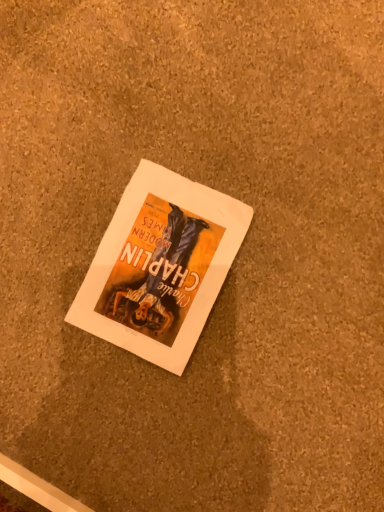
Find the location of `vacant area that is in front of matte paper book at center`. vacant area that is in front of matte paper book at center is located at coordinates (200, 395).